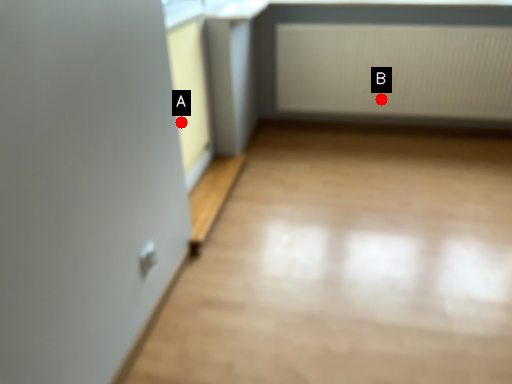
Question: Two points are circled on the image, labeled by A and B beside each circle. Which of the following is the farthest from the observer?

Choices:
 (A) A is further
 (B) B is further

Answer: (B)